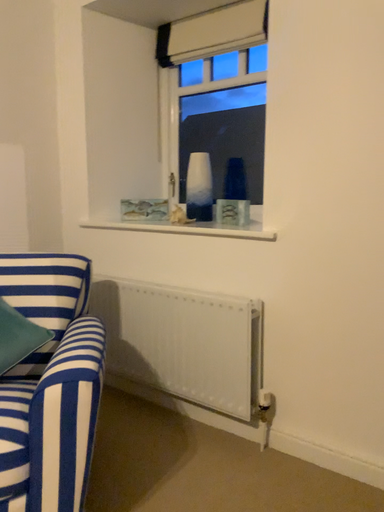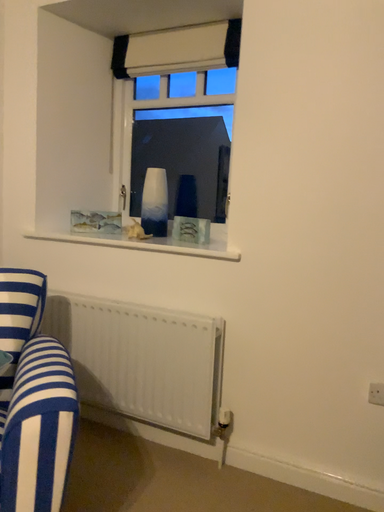
Question: How did the camera likely rotate when shooting the video?

Choices:
 (A) rotated right
 (B) rotated left

Answer: (A)